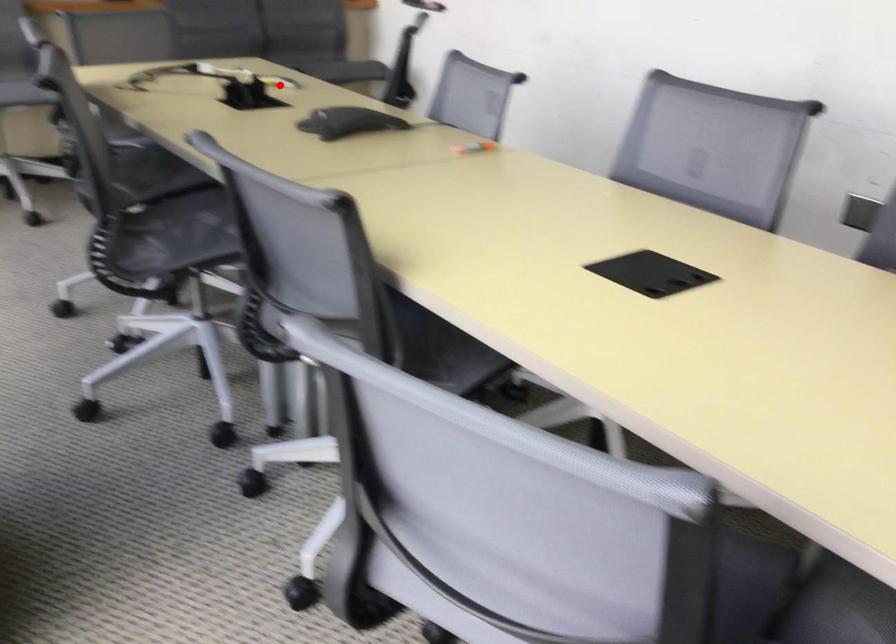
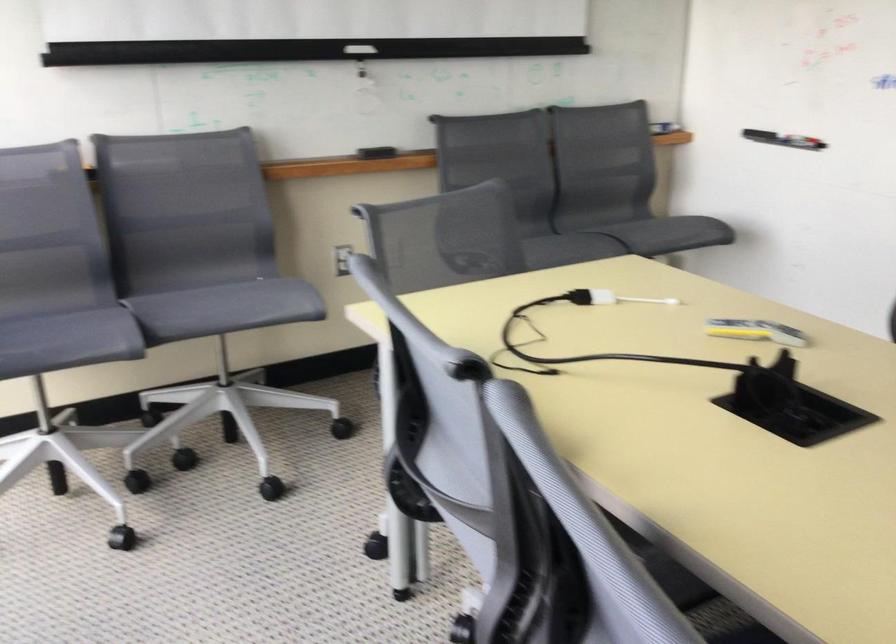
Question: I am providing you with two images of the same scene from different viewpoints. A red point is marked on the first image. At the location where the point appears in image 1, is it still visible in image 2?

Choices:
 (A) Yes
 (B) No

Answer: (A)